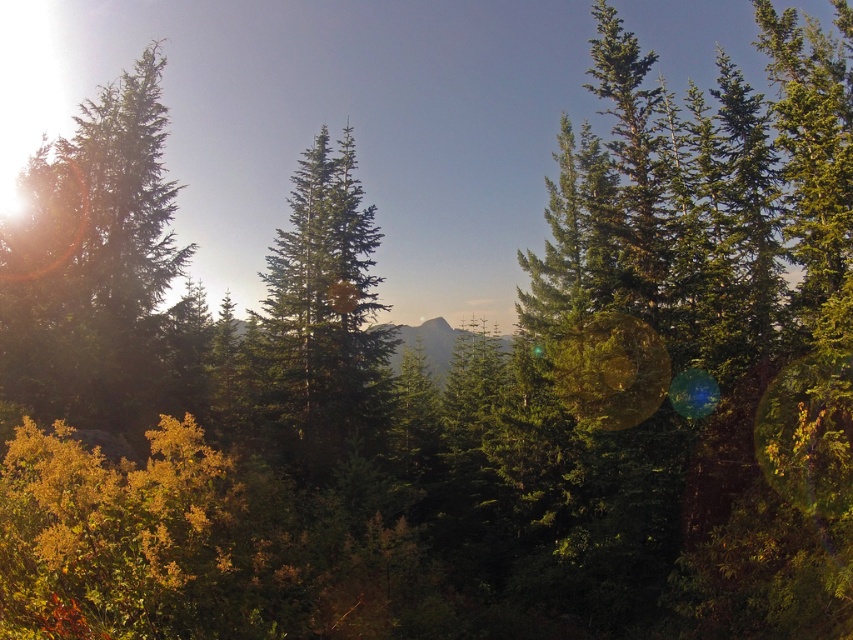
Question: Where is green needle-like tree at center located in relation to green textured mountain at center in the image?

Choices:
 (A) below
 (B) above

Answer: (B)

Question: Is green matte tree at left behind green textured mountain at center?

Choices:
 (A) yes
 (B) no

Answer: (B)

Question: Which object is the closest to the green textured mountain at center?

Choices:
 (A) green needle-like tree at center
 (B) green matte tree at left

Answer: (A)

Question: Estimate the real-world distances between objects in this image. Which object is closer to the green needle-like tree at center?

Choices:
 (A) green textured mountain at center
 (B) green matte tree at left

Answer: (B)

Question: Which of these objects is positioned closest to the green matte tree at left?

Choices:
 (A) green textured mountain at center
 (B) green needle-like tree at center

Answer: (B)

Question: Is green matte tree at left smaller than green textured mountain at center?

Choices:
 (A) no
 (B) yes

Answer: (A)